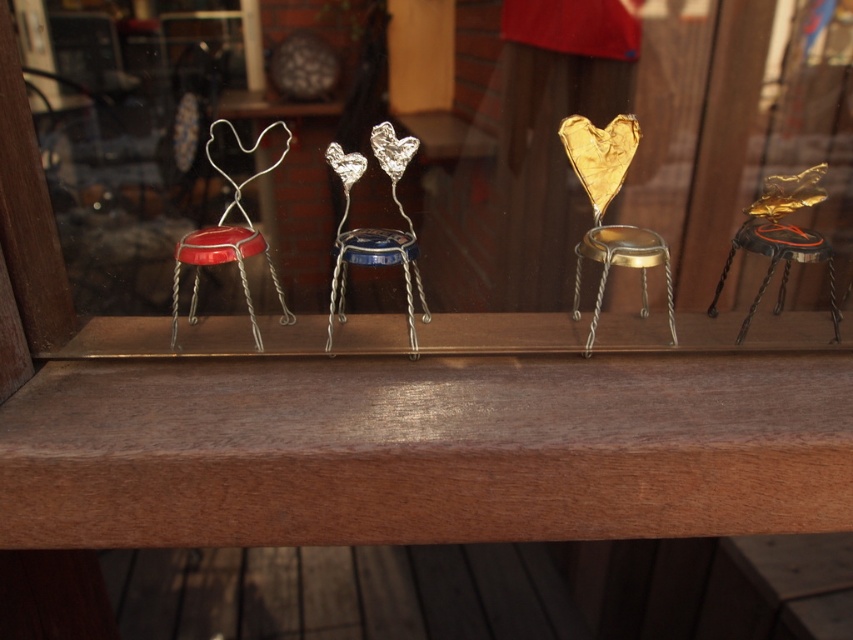
Question: Is blue metallic stool at center to the left of shiny red cap at left from the viewer's perspective?

Choices:
 (A) yes
 (B) no

Answer: (B)

Question: Which of these objects is positioned farthest from the gold metallic stool at center?

Choices:
 (A) metallic wire stools at center
 (B) shiny red cap at left
 (C) gold metallic stool at right

Answer: (B)

Question: Which point is closer to the camera taking this photo?

Choices:
 (A) (329, 321)
 (B) (764, 228)

Answer: (A)

Question: Can you confirm if metallic wire stools at center is wider than shiny red cap at left?

Choices:
 (A) yes
 (B) no

Answer: (A)

Question: Can you confirm if metallic wire stools at center is bigger than shiny red cap at left?

Choices:
 (A) yes
 (B) no

Answer: (A)

Question: Which point is farther from the camera taking this photo?

Choices:
 (A) (381, 237)
 (B) (45, 308)
 (C) (583, 241)

Answer: (C)